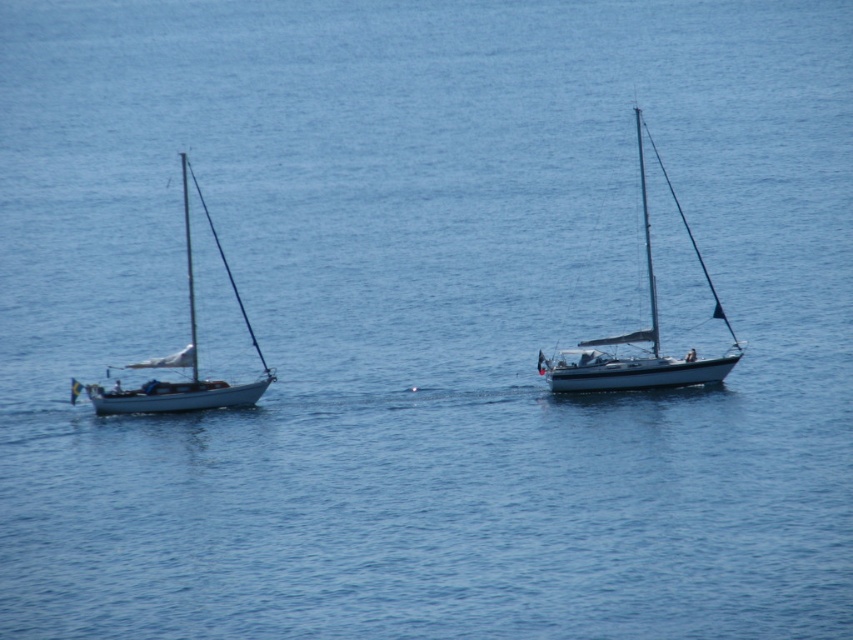
Which is below, white glossy sailboat at center or white matte mast at upper center?

white glossy sailboat at center is below.

From the picture: Between white glossy sailboat at center and white matte mast at upper center, which one appears on the left side from the viewer's perspective?

Positioned to the left is white matte mast at upper center.

Which is in front, point (645, 257) or point (651, 330)?

Point (651, 330) is in front.

Locate an element on the screen. white glossy sailboat at center is located at coordinates (641, 330).

Which is more to the left, white matte sailboat at left or white matte mast at upper center?

Positioned to the left is white matte sailboat at left.

What do you see at coordinates (184, 353) in the screenshot? I see `white matte sailboat at left` at bounding box center [184, 353].

The width and height of the screenshot is (853, 640). Describe the element at coordinates (184, 353) in the screenshot. I see `white matte sailboat at left` at that location.

Find the location of a particular element. white matte sailboat at left is located at coordinates (184, 353).

Between white glossy sailboat at center and white matte sailboat at left, which one appears on the right side from the viewer's perspective?

white glossy sailboat at center is more to the right.

Does white glossy sailboat at center have a larger size compared to white matte sailboat at left?

Yes.

The height and width of the screenshot is (640, 853). What do you see at coordinates (641, 330) in the screenshot? I see `white glossy sailboat at center` at bounding box center [641, 330].

Where is `white glossy sailboat at center`? white glossy sailboat at center is located at coordinates (641, 330).